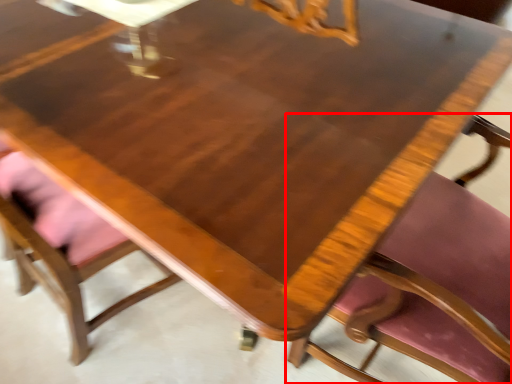
Question: Observing the image, what is the correct spatial positioning of chair (annotated by the red box) in reference to chair?

Choices:
 (A) right
 (B) left

Answer: (A)